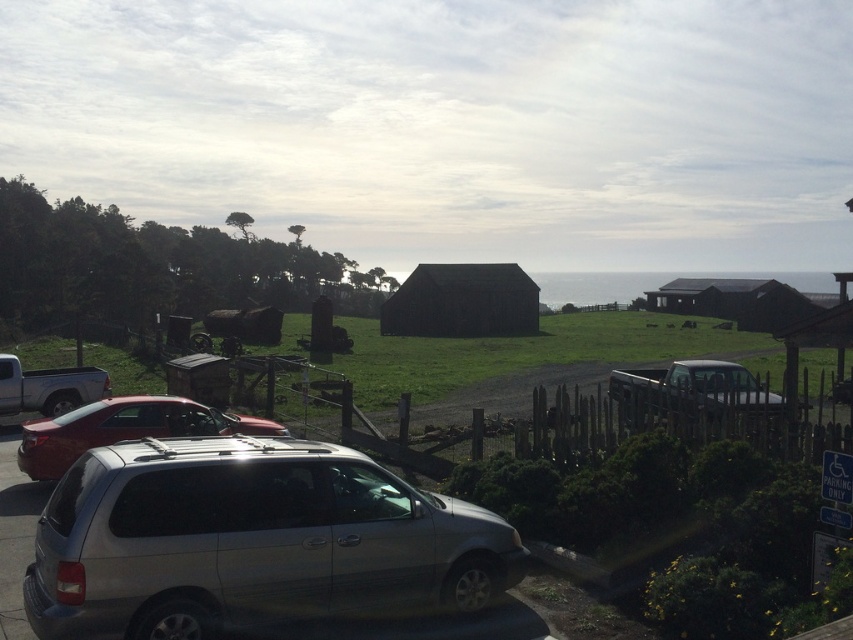
Question: From the image, what is the correct spatial relationship of black wooden hut at center in relation to silver metallic suv at lower left?

Choices:
 (A) left
 (B) right

Answer: (B)

Question: Which point is closer to the camera taking this photo?

Choices:
 (A) (39, 394)
 (B) (432, 275)
 (C) (682, 397)
 (D) (254, 417)

Answer: (C)

Question: Does shiny red car at center have a smaller size compared to black wooden hut at center?

Choices:
 (A) yes
 (B) no

Answer: (A)

Question: Which point is closer to the camera?

Choices:
 (A) metallic silver truck at right
 (B) satin silver minivan at center
 (C) black wooden hut at center
 (D) shiny red car at center

Answer: (B)

Question: Considering the relative positions of satin silver minivan at center and metallic silver truck at right in the image provided, where is satin silver minivan at center located with respect to metallic silver truck at right?

Choices:
 (A) above
 (B) below

Answer: (B)

Question: Which object appears closest to the camera in this image?

Choices:
 (A) silver metallic suv at lower left
 (B) dark brown wooden hut at right
 (C) shiny red car at center
 (D) satin silver minivan at center

Answer: (D)